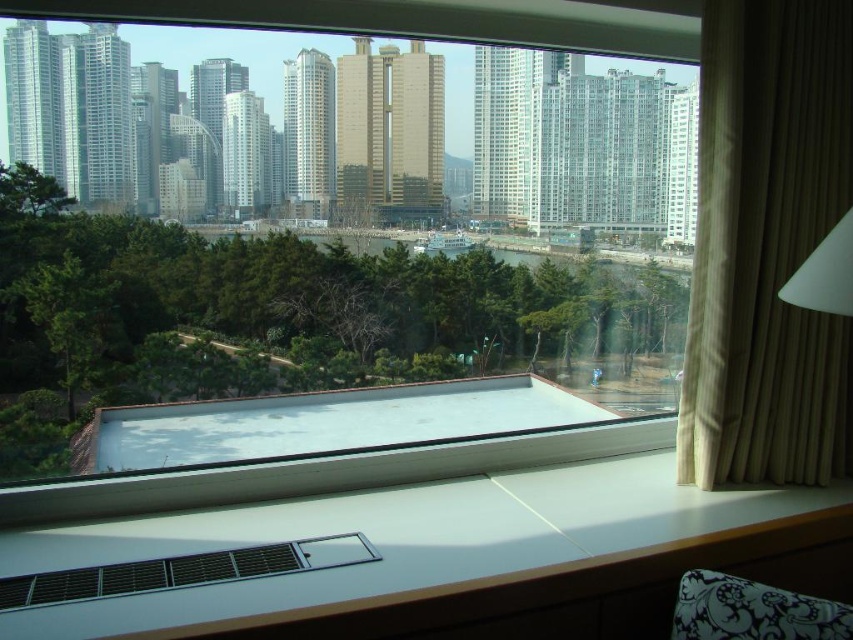
Question: Is transparent glass window at center to the left of white matte lampshade at upper right from the viewer's perspective?

Choices:
 (A) no
 (B) yes

Answer: (B)

Question: Is matte plastic vent at lower center bigger than white matte lampshade at upper right?

Choices:
 (A) yes
 (B) no

Answer: (A)

Question: Which point is closer to the camera taking this photo?

Choices:
 (A) (280, 307)
 (B) (735, 458)
 (C) (363, 552)
 (D) (843, 301)

Answer: (C)

Question: Which object appears closest to the camera in this image?

Choices:
 (A) matte plastic vent at lower center
 (B) white matte lampshade at upper right
 (C) beige fabric curtain at right
 (D) transparent glass window at center

Answer: (A)

Question: Which point is closer to the camera taking this photo?

Choices:
 (A) (718, 396)
 (B) (181, 566)

Answer: (B)

Question: Can you confirm if matte plastic vent at lower center is smaller than white matte lampshade at upper right?

Choices:
 (A) yes
 (B) no

Answer: (B)